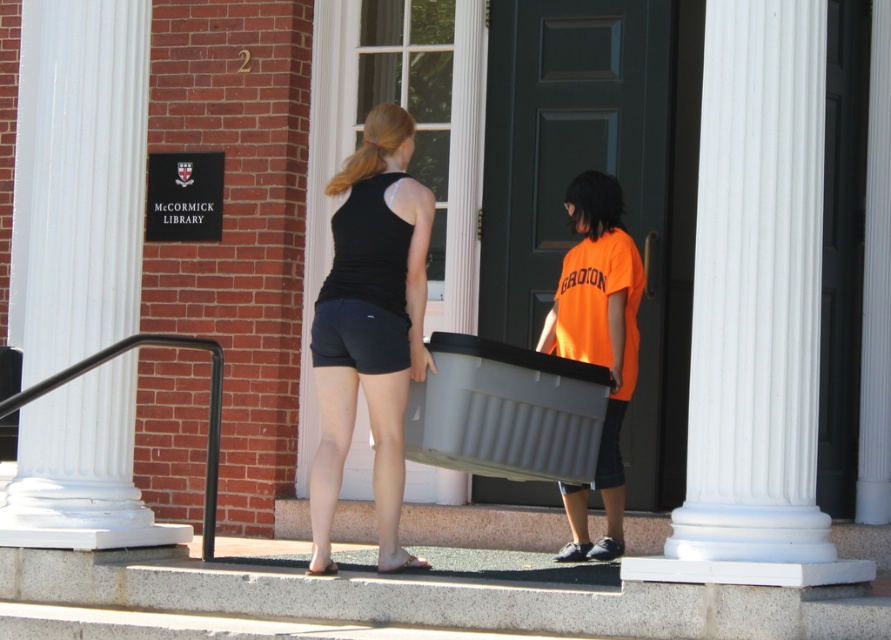
Which is in front, point (69, 316) or point (97, 360)?

Point (97, 360) is more forward.

Does white glossy pillar at left appear under black metal handrail at lower left?

Actually, white glossy pillar at left is above black metal handrail at lower left.

In order to click on white glossy pillar at left in this screenshot , I will do `click(84, 180)`.

Where is `white glossy pillar at left`? This screenshot has width=891, height=640. white glossy pillar at left is located at coordinates (84, 180).

Does orange matte shirt at center appear on the right side of black metal handrail at lower left?

Indeed, orange matte shirt at center is positioned on the right side of black metal handrail at lower left.

The width and height of the screenshot is (891, 640). What are the coordinates of `orange matte shirt at center` in the screenshot? It's located at (597, 342).

Is white smooth column at center below black matte tank top at center?

Incorrect, white smooth column at center is not positioned below black matte tank top at center.

This screenshot has height=640, width=891. What are the coordinates of `white smooth column at center` in the screenshot? It's located at (756, 289).

Measure the distance between point [701,262] and camera.

7.79 meters

You are a GUI agent. You are given a task and a screenshot of the screen. Output one action in this format:
    pyautogui.click(x=<x>, y=<y>)
    Task: Click on the white smooth column at center
    This screenshot has height=640, width=891.
    Given the screenshot: What is the action you would take?
    pyautogui.click(x=756, y=289)